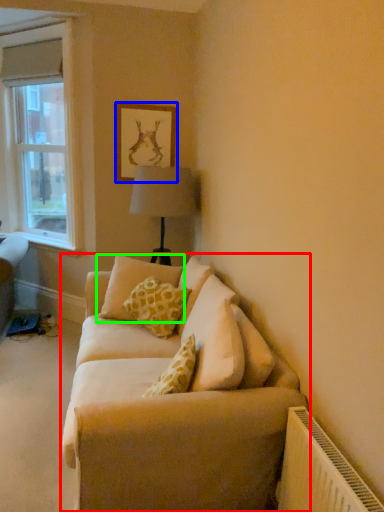
Question: Which object is positioned closest to studio couch (highlighted by a red box)? Select from picture frame (highlighted by a blue box) and pillow (highlighted by a green box).

Choices:
 (A) picture frame
 (B) pillow

Answer: (B)